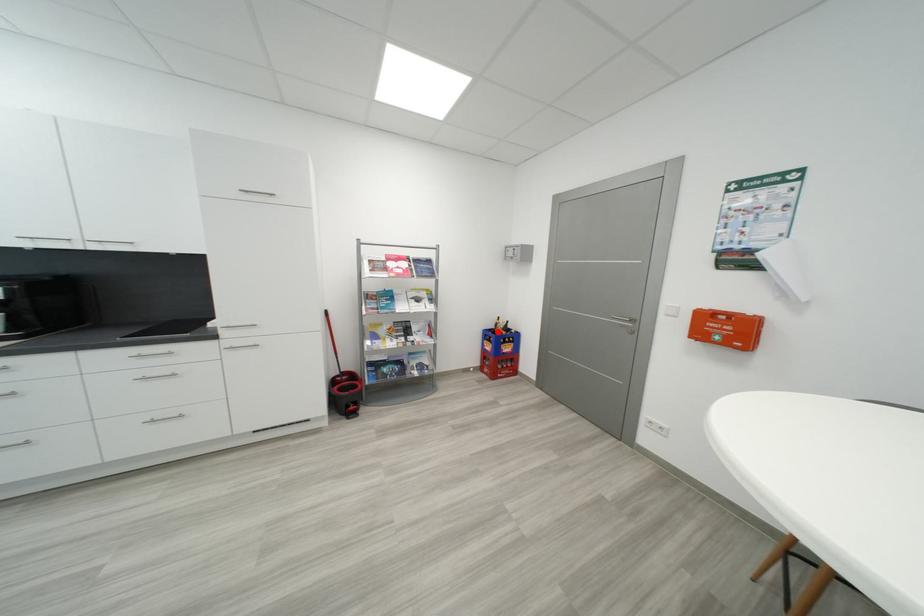
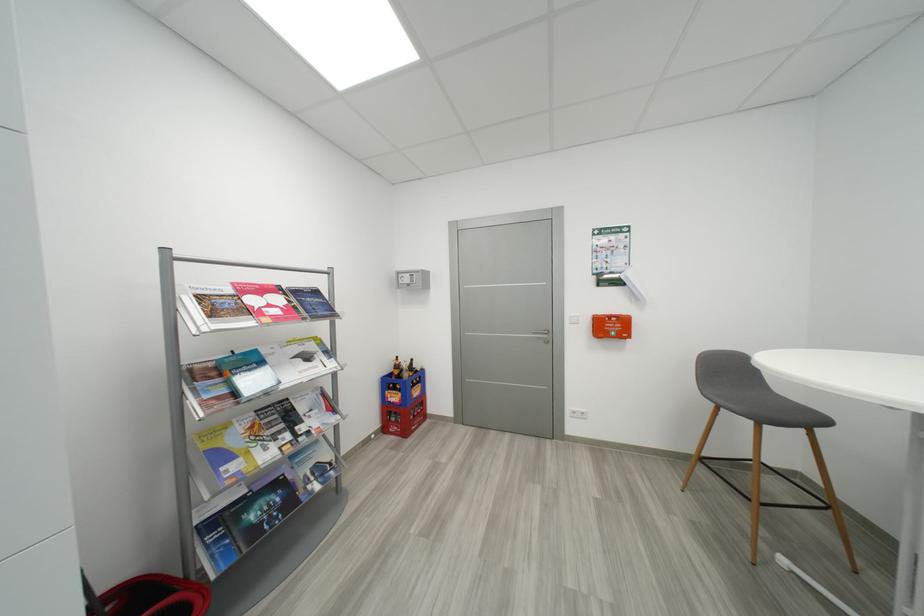
Question: I am providing you with two images of the same scene from different viewpoints. Given a red point in image1, look at the same physical point in image2. Is it:

Choices:
 (A) Closer to the viewpoint
 (B) Farther from the viewpoint

Answer: (B)